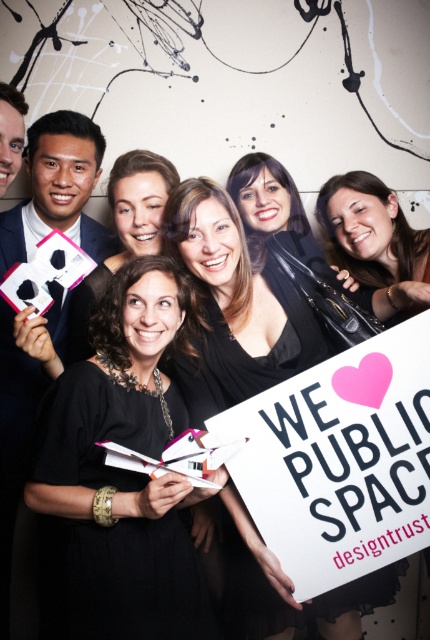
Is white paper sign at center to the left of black matte sign at center from the viewer's perspective?

Indeed, white paper sign at center is positioned on the left side of black matte sign at center.

Is white paper sign at center in front of black matte sign at center?

Yes, it is in front of black matte sign at center.

Describe the element at coordinates (340, 460) in the screenshot. The image size is (430, 640). I see `white paper sign at center` at that location.

Image resolution: width=430 pixels, height=640 pixels. I want to click on white paper sign at center, so click(x=340, y=460).

Can you confirm if black matte dress at center is wider than matte black hair at center?

Correct, the width of black matte dress at center exceeds that of matte black hair at center.

In order to click on black matte dress at center in this screenshot , I will do `click(122, 472)`.

This screenshot has height=640, width=430. In order to click on black matte dress at center in this screenshot , I will do `click(122, 472)`.

Can you confirm if black matte sign at center is bigger than matte black hair at center?

Yes.

Image resolution: width=430 pixels, height=640 pixels. What do you see at coordinates (371, 230) in the screenshot?
I see `black matte sign at center` at bounding box center [371, 230].

Locate an element on the screen. The width and height of the screenshot is (430, 640). black matte sign at center is located at coordinates (371, 230).